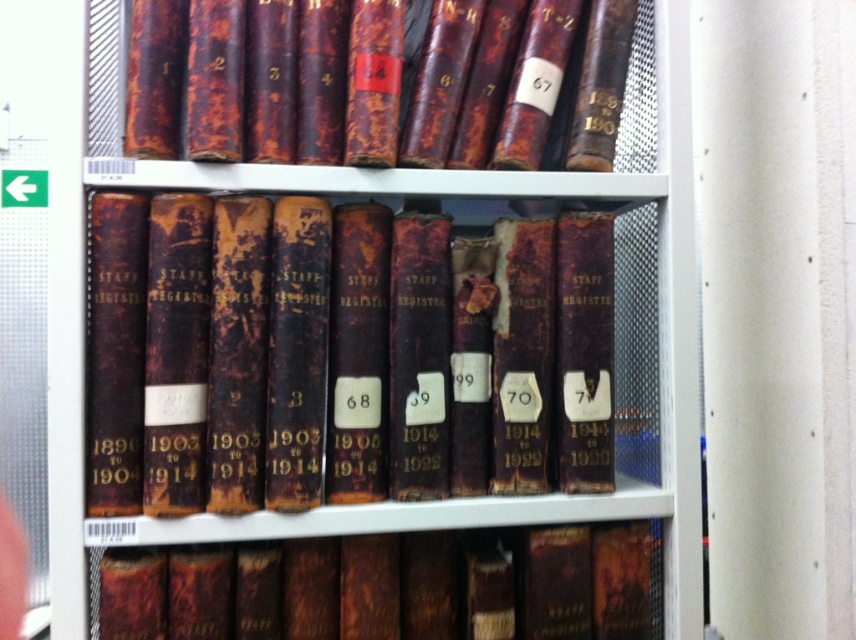
Question: Is rusty leather book at upper center thinner than rusty leather book at center?

Choices:
 (A) no
 (B) yes

Answer: (B)

Question: Which object is the farthest from the dark brown leather book at center?

Choices:
 (A) rusty leather book at center
 (B) rusty leather book at upper center

Answer: (B)

Question: Which point is farther from the camera taking this photo?

Choices:
 (A) (236, 147)
 (B) (548, 540)
 (C) (508, 464)

Answer: (B)

Question: Observing the image, what is the correct spatial positioning of dark brown leather book at center in reference to rusty leather book at upper center?

Choices:
 (A) above
 (B) below

Answer: (B)

Question: Considering the real-world distances, which object is closest to the rusty leather book at center?

Choices:
 (A) rusty leather book at upper center
 (B) dark brown leather book at center

Answer: (B)

Question: Does dark brown leather book at center appear over rusty leather book at upper center?

Choices:
 (A) no
 (B) yes

Answer: (A)